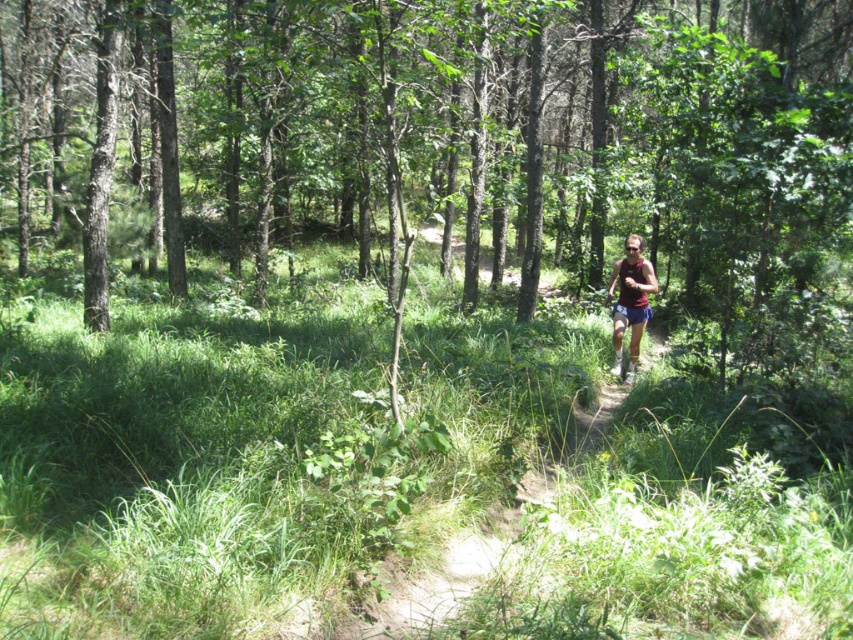
You are a hiker who wants to take a photo of the maroon fabric shorts at center without the brown bark tree at center blocking the view. Which direction should you move to ensure the tree is out of the frame?

The brown bark tree at center is above the maroon fabric shorts at center, so you should move downward or to the side to avoid the tree blocking the view.